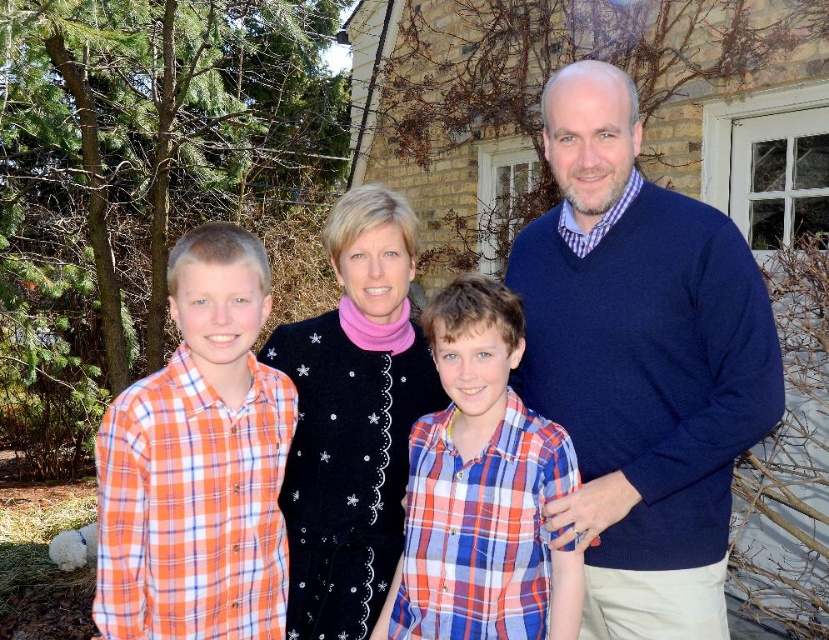
You are a photographer trying to capture the family in a group photo. You notice the orange plaid shirt at left and the black velvet sweater at center. Which of these two items is shorter in height?

The orange plaid shirt at left is not as tall as the black velvet sweater at center, so the orange plaid shirt at left is shorter in height.

You are standing 10 feet away from the camera. You want to hand a gift to the person wearing the navy blue sweater at right. Can you reach them without moving?

The navy blue sweater at right is 7.45 feet away from the camera. Since you are 10 feet away from the camera, you are 2.55 feet farther than the navy blue sweater at right. Therefore, you cannot reach them without moving closer.